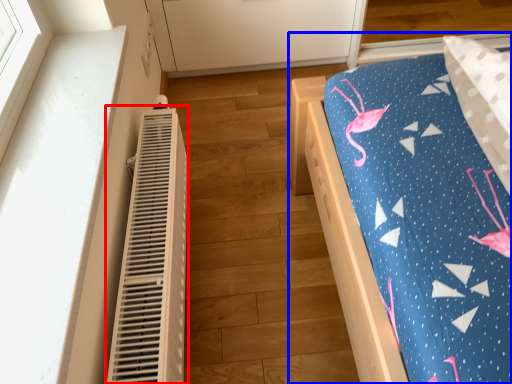
Question: Which object is closer to the camera taking this photo, heater (highlighted by a red box) or furniture (highlighted by a blue box)?

Choices:
 (A) heater
 (B) furniture

Answer: (A)